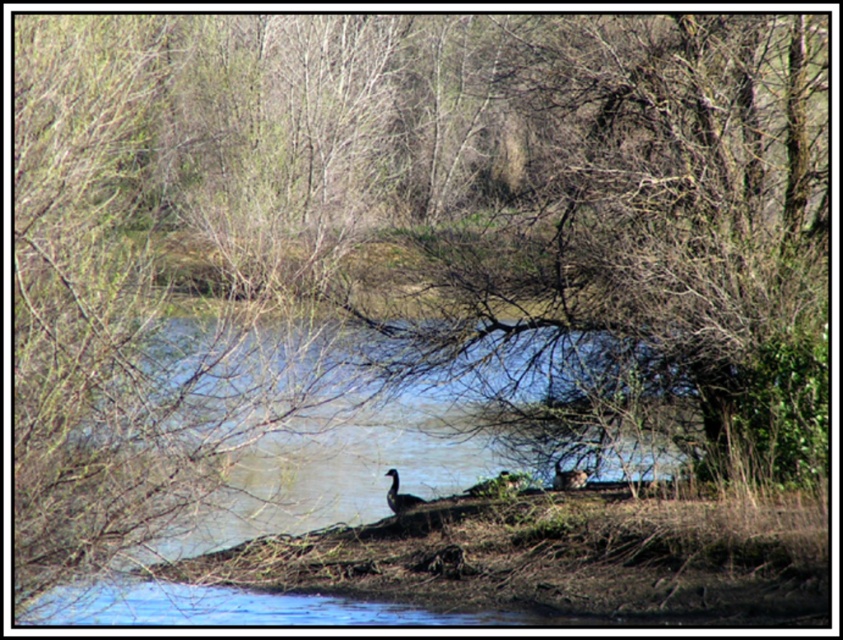
Is clear blue water at center bigger than brown matte duck at center?

Indeed, clear blue water at center has a larger size compared to brown matte duck at center.

Who is positioned more to the right, clear blue water at center or brown matte duck at center?

brown matte duck at center

This screenshot has height=640, width=843. Identify the location of clear blue water at center. (337, 472).

Where is `clear blue water at center`? clear blue water at center is located at coordinates (337, 472).

Is dark gray duck at center above brown matte duck at center?

Incorrect, dark gray duck at center is not positioned above brown matte duck at center.

Which is below, dark gray duck at center or brown matte duck at center?

dark gray duck at center is lower down.

Between point (389, 506) and point (557, 464), which one is positioned behind?

Positioned behind is point (557, 464).

Image resolution: width=843 pixels, height=640 pixels. Identify the location of dark gray duck at center. (399, 496).

Is clear blue water at center positioned before dark gray duck at center?

Yes, it is in front of dark gray duck at center.

Looking at this image, measure the distance between point (352, 492) and camera.

Point (352, 492) and camera are 71.46 feet apart from each other.

Identify the location of clear blue water at center. The height and width of the screenshot is (640, 843). (337, 472).

Where is `clear blue water at center`? clear blue water at center is located at coordinates (337, 472).